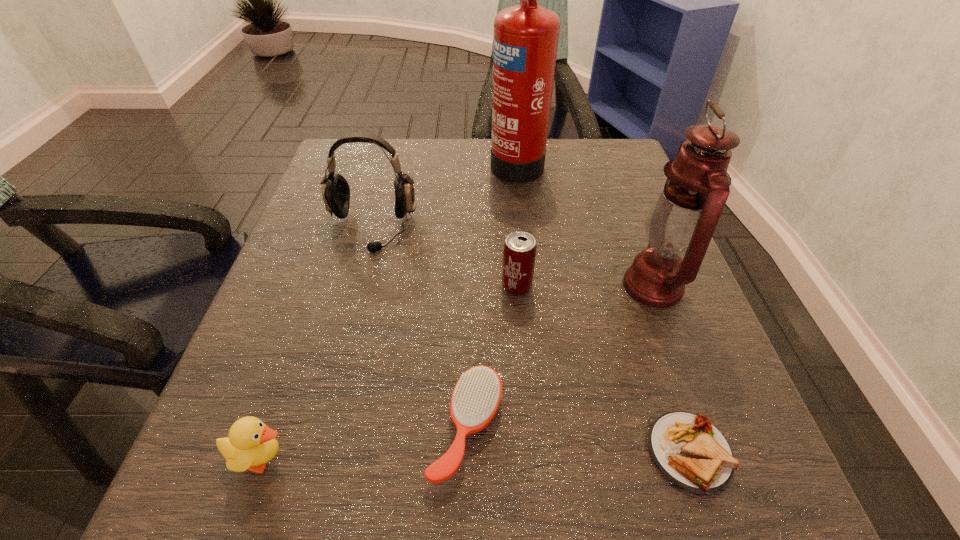
Where is `blank region between the duckling and the farthest object`? This screenshot has height=540, width=960. blank region between the duckling and the farthest object is located at coordinates (390, 309).

Locate an element on the screen. free space that is in between the beer can and the shortest object is located at coordinates (603, 369).

What are the coordinates of `free space between the third shortest object and the beer can` in the screenshot? It's located at (390, 372).

This screenshot has height=540, width=960. Find the location of `free space between the hairbrush and the farthest object`. free space between the hairbrush and the farthest object is located at coordinates point(492,294).

Find the location of `empty space that is in between the headset and the beer can`. empty space that is in between the headset and the beer can is located at coordinates (444, 258).

Locate which object is the third closest to the shortest object. Please provide its 2D coordinates. Your answer should be formatted as a tuple, i.e. [(x, y)], where the tuple contains the x and y coordinates of a point satisfying the conditions above.

[(519, 253)]

Where is `object that ranks as the fifth closest to the headset`? The image size is (960, 540). object that ranks as the fifth closest to the headset is located at coordinates (681, 222).

In order to click on vacant area that satisfies the following two spatial constraints: 1. on the back side of the beer can; 2. on the left side of the hairbrush in this screenshot , I will do `click(469, 286)`.

Find the location of `free location that satisfies the following two spatial constraints: 1. with the microphone on the side of the beer can; 2. on the right side of the sixth nearest object`. free location that satisfies the following two spatial constraints: 1. with the microphone on the side of the beer can; 2. on the right side of the sixth nearest object is located at coordinates (356, 286).

In order to click on vacant space that satisfies the following two spatial constraints: 1. with the microphone on the side of the sixth nearest object; 2. on the left side of the shortest object in this screenshot , I will do `click(313, 452)`.